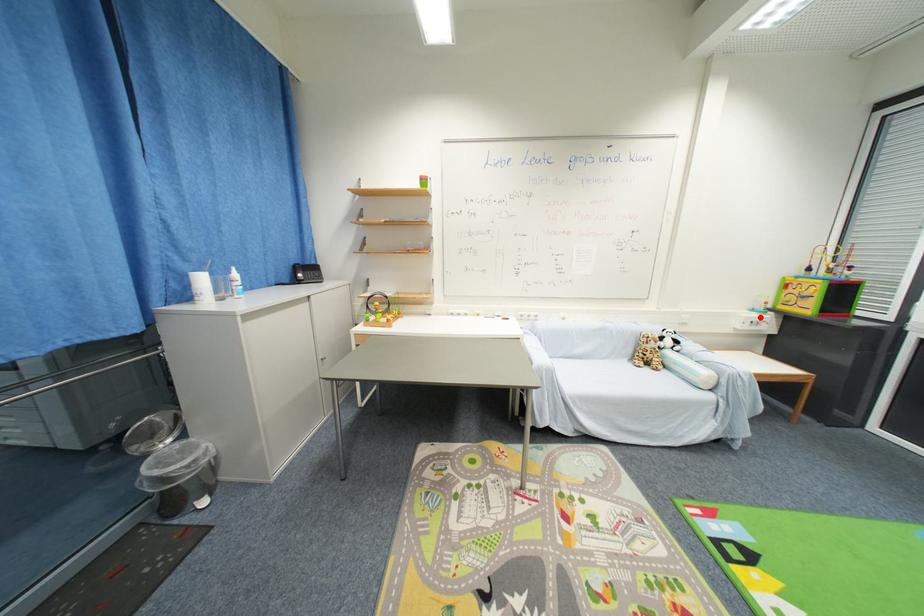
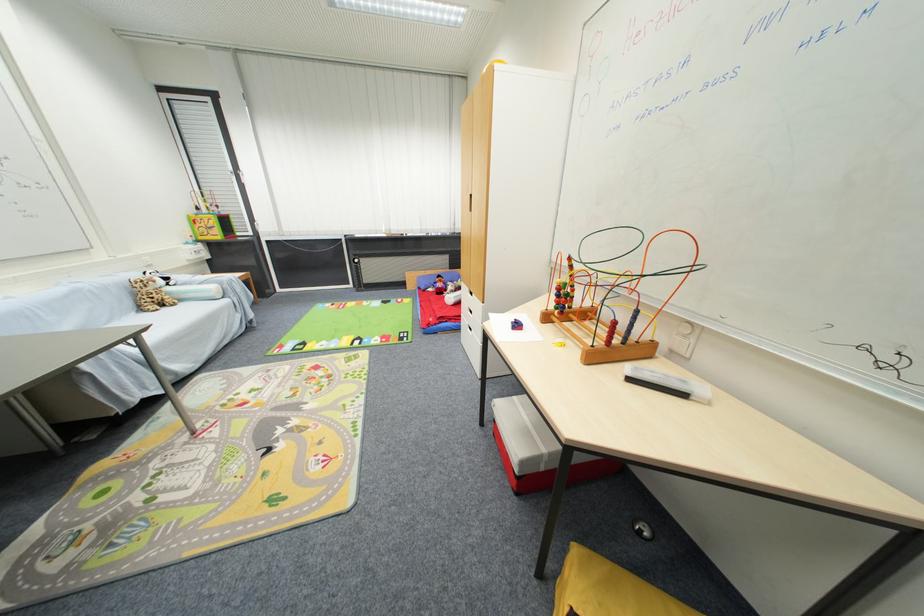
Find the pixel in the second image that matches the highlighted location in the first image.

(198, 249)